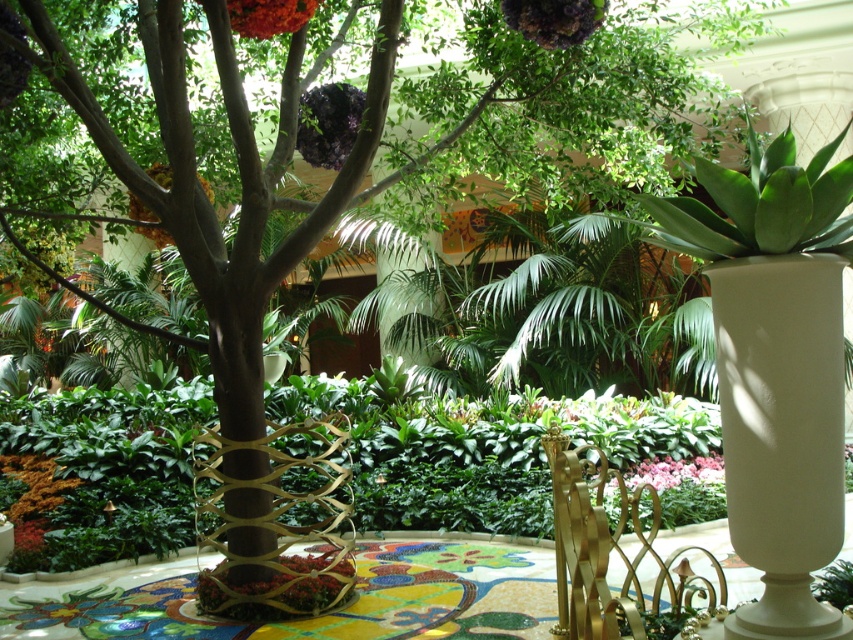
In the scene shown: You are a florist arranging a bouquet and need to know the spatial relationship between the orange fuzzy flower at lower left and the pink matte flowers at center. Which flower is positioned to the left?

The orange fuzzy flower at lower left is positioned to the left of the pink matte flowers at center.

You are a florist arranging flowers in the white glossy vase at right and the shiny orange flower at upper center. Which object is taller?

The white glossy vase at right is much taller than the shiny orange flower at upper center.